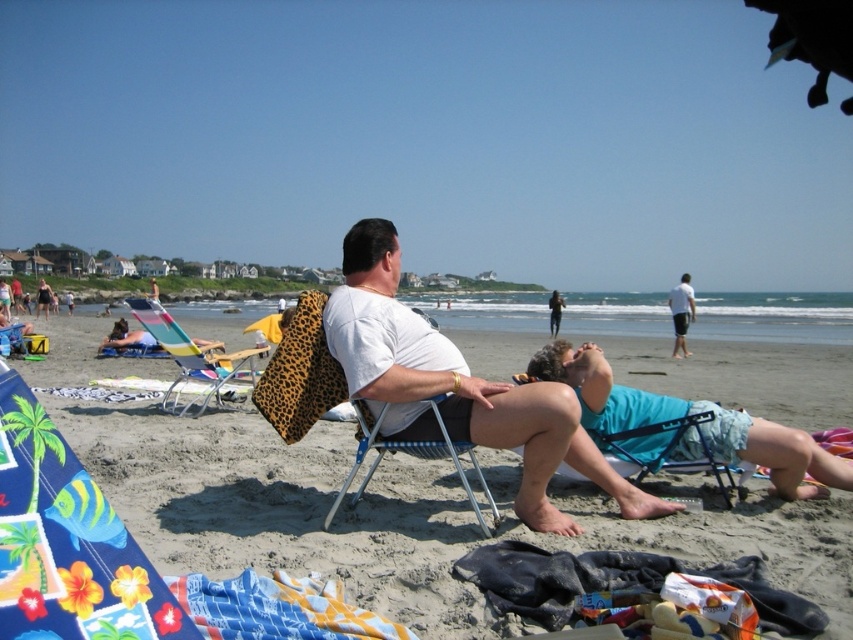
Consider the image. Who is taller, white matte shirt at center or blue fabric shorts at lower right?

With more height is white matte shirt at center.

Does point (347, 289) come closer to viewer compared to point (560, 356)?

Yes, point (347, 289) is closer to viewer.

Is point (392, 426) positioned before point (773, 428)?

Yes, it is.

I want to click on white matte shirt at center, so click(457, 387).

Is white cotton shirt at center thinner than metallic blue beach chair at center?

No, white cotton shirt at center is not thinner than metallic blue beach chair at center.

Between point (138, 483) and point (375, 435), which one is positioned behind?

Positioned behind is point (138, 483).

This screenshot has height=640, width=853. In order to click on white cotton shirt at center in this screenshot , I will do `click(283, 508)`.

Which of these two, blue fabric shorts at lower right or metallic blue beach chair at center, stands taller?

metallic blue beach chair at center is taller.

Does point (747, 433) come closer to viewer compared to point (454, 456)?

No, (747, 433) is behind (454, 456).

At what (x,y) coordinates should I click in order to perform the action: click on blue fabric shorts at lower right. Please return your answer as a coordinate pair (x, y). Looking at the image, I should click on (689, 428).